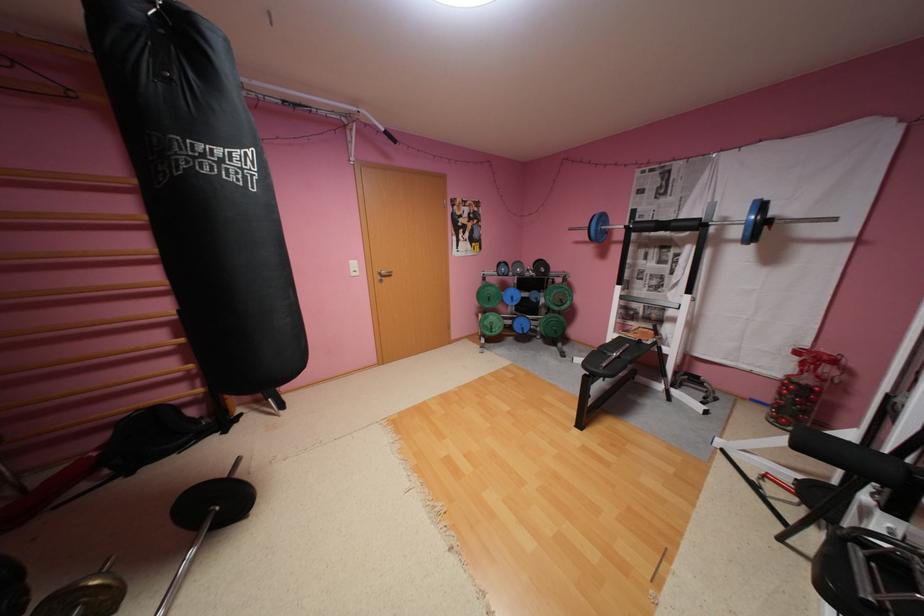
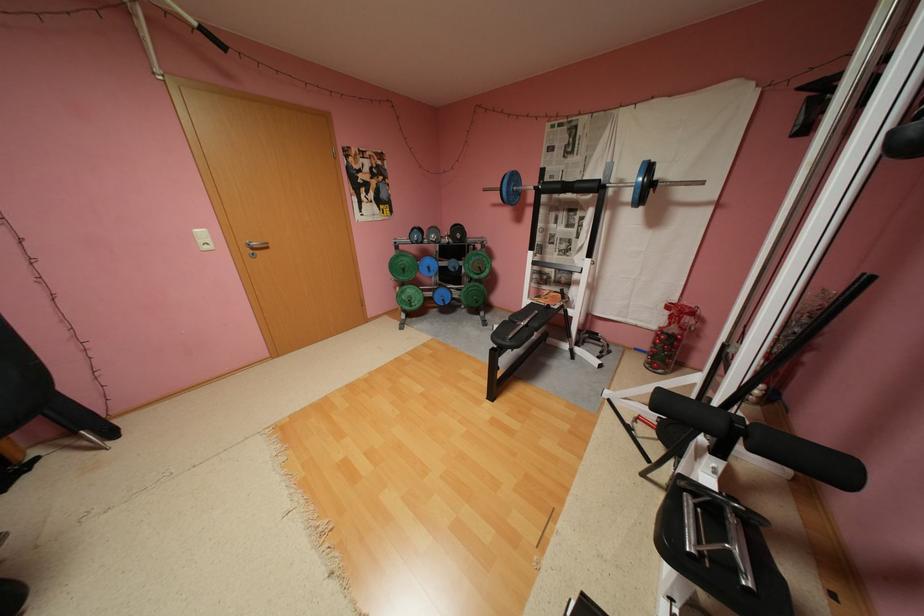
In the second image, find the point that corresponds to (683,224) in the first image.

(586, 185)